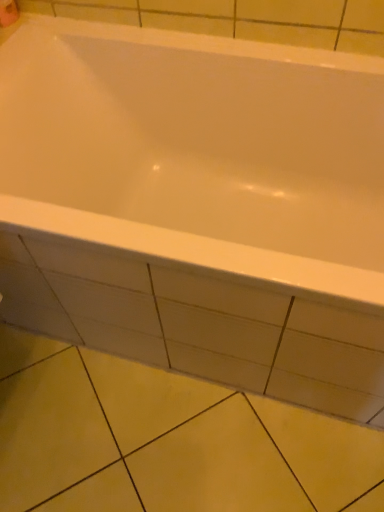
Question: Would you say white paper at upper left is to the left or to the right of yellow matte tile at lower center in the picture?

Choices:
 (A) left
 (B) right

Answer: (A)

Question: Looking at their shapes, would you say white paper at upper left is wider or thinner than yellow matte tile at lower center?

Choices:
 (A) thin
 (B) wide

Answer: (A)

Question: Considering the real-world distances, which object is farthest from the white glossy bathtub at center?

Choices:
 (A) white paper at upper left
 (B) yellow matte tile at lower center

Answer: (A)

Question: Which of these objects is positioned farthest from the white paper at upper left?

Choices:
 (A) white glossy bathtub at center
 (B) yellow matte tile at lower center

Answer: (B)